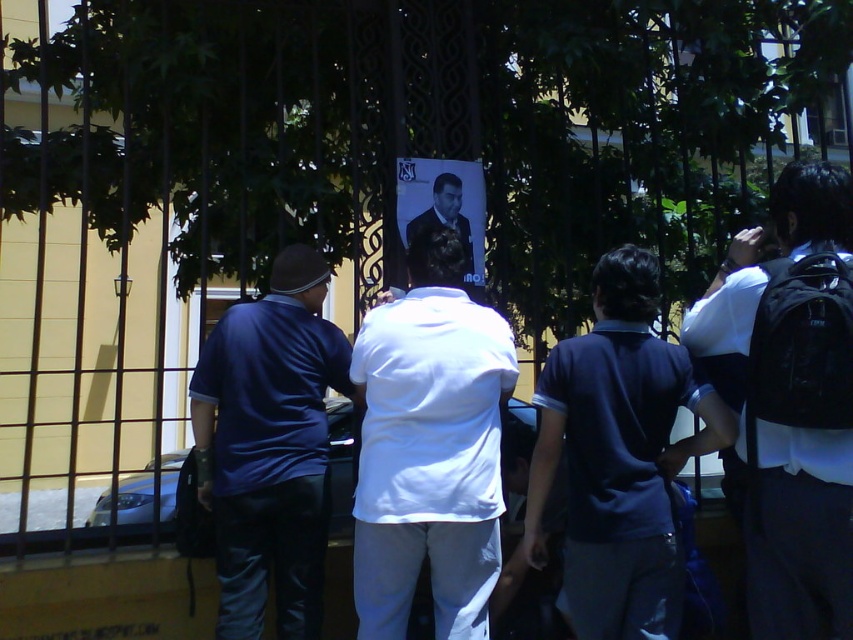
This screenshot has height=640, width=853. What do you see at coordinates (428, 448) in the screenshot?
I see `white matte shirt at center` at bounding box center [428, 448].

Can you confirm if white matte shirt at center is positioned to the right of matte blue shirt at center?

Yes, white matte shirt at center is to the right of matte blue shirt at center.

Find the location of `white matte shirt at center`. white matte shirt at center is located at coordinates (428, 448).

This screenshot has height=640, width=853. I want to click on white matte shirt at center, so click(x=428, y=448).

Can you confirm if white matte shirt at center is bigger than dark blue shirt at center?

Actually, white matte shirt at center might be smaller than dark blue shirt at center.

Does white matte shirt at center have a greater width compared to dark blue shirt at center?

No.

The height and width of the screenshot is (640, 853). What do you see at coordinates (428, 448) in the screenshot? I see `white matte shirt at center` at bounding box center [428, 448].

This screenshot has width=853, height=640. I want to click on white matte shirt at center, so click(428, 448).

Can you confirm if dark blue shirt at center is shorter than dark suit at center?

No, dark blue shirt at center is not shorter than dark suit at center.

Does point (596, 369) come closer to viewer compared to point (404, 236)?

Yes, it is.

Locate an element on the screen. The height and width of the screenshot is (640, 853). dark blue shirt at center is located at coordinates (619, 456).